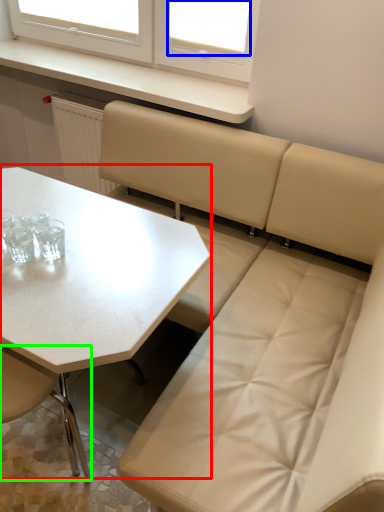
Question: Considering the real-world distances, which object is closest to table (highlighted by a red box)? window screen (highlighted by a blue box) or chair (highlighted by a green box).

Choices:
 (A) window screen
 (B) chair

Answer: (B)